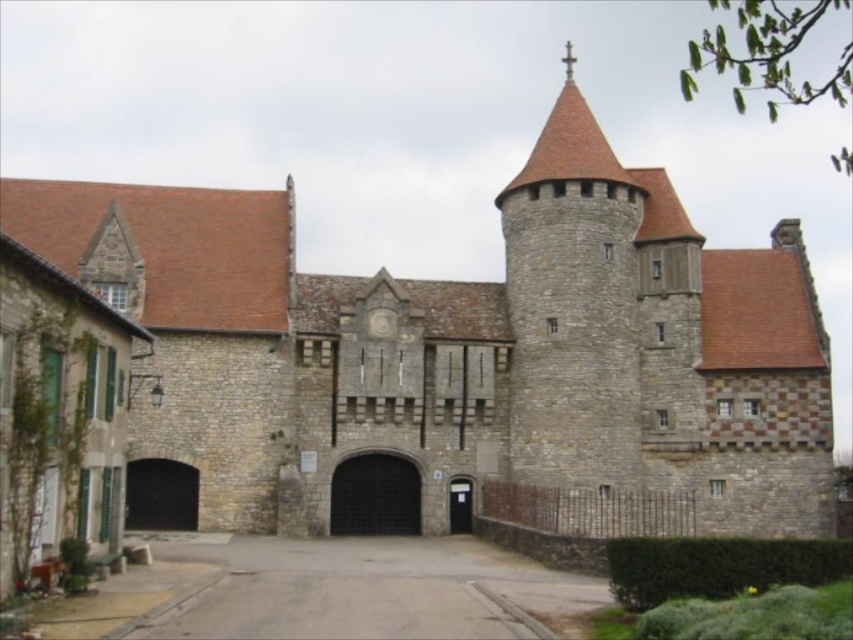
Who is lower down, dark gray stone gate at center or dark brown stone archway at lower left?

dark brown stone archway at lower left is below.

You are a GUI agent. You are given a task and a screenshot of the screen. Output one action in this format:
    pyautogui.click(x=<x>, y=<y>)
    Task: Click on the dark gray stone gate at center
    The width and height of the screenshot is (853, 640).
    Given the screenshot: What is the action you would take?
    pyautogui.click(x=375, y=496)

Where is `dark gray stone gate at center`? The height and width of the screenshot is (640, 853). dark gray stone gate at center is located at coordinates (375, 496).

Locate an element on the screen. Image resolution: width=853 pixels, height=640 pixels. dark gray stone gate at center is located at coordinates (375, 496).

Who is lower down, dark brown stone archway at lower left or black metal gate at center?

black metal gate at center is below.

Is point (126, 483) positioned behind point (471, 516)?

No, (126, 483) is in front of (471, 516).

Does point (144, 497) come in front of point (462, 497)?

Yes.

Identify the location of dark brown stone archway at lower left. (160, 496).

Looking at this image, measure the distance from gray asphalt driveway at center to black metal gate at center.

12.10 meters

Looking at this image, can you confirm if gray asphalt driveway at center is positioned above black metal gate at center?

No.

Who is more forward, (x=584, y=596) or (x=450, y=518)?

Point (x=584, y=596) is more forward.

I want to click on gray asphalt driveway at center, so click(x=366, y=589).